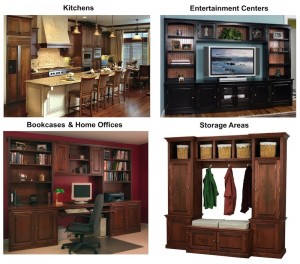
You are a GUI agent. You are given a task and a screenshot of the screen. Output one action in this format:
    pyautogui.click(x=<x>, y=<y>)
    Task: Click on the chairs
    This screenshot has height=264, width=300.
    Given the screenshot: What is the action you would take?
    pyautogui.click(x=75, y=92), pyautogui.click(x=97, y=88), pyautogui.click(x=111, y=84), pyautogui.click(x=124, y=81)